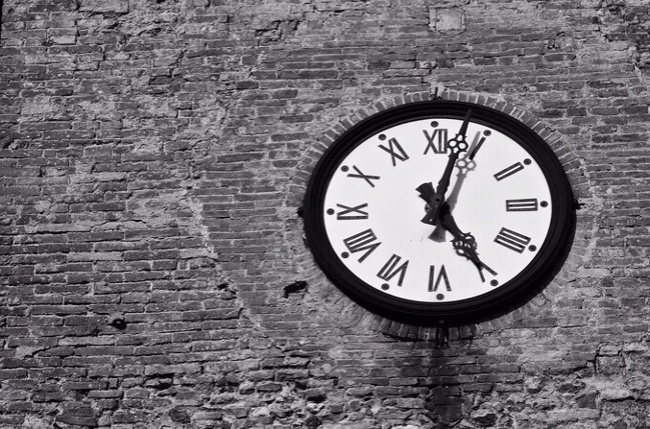
This screenshot has height=429, width=650. What are the coordinates of `wall` in the screenshot? It's located at (166, 119).